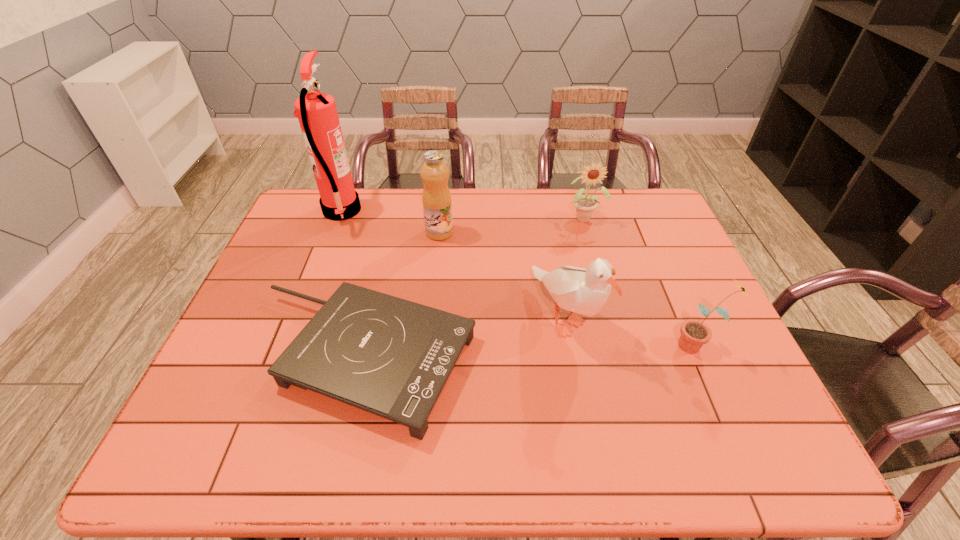
At what (x,y) coordinates should I click in order to perform the action: click on hotplate at the left edge. Please return your answer as a coordinate pair (x, y). The image size is (960, 540). Looking at the image, I should click on (391, 357).

The height and width of the screenshot is (540, 960). I want to click on object present at the right edge, so click(x=694, y=334).

I want to click on object located in the far left corner section of the desktop, so click(317, 113).

At what (x,y) coordinates should I click in order to perform the action: click on object located in the near left corner section of the desktop. Please return your answer as a coordinate pair (x, y). Image resolution: width=960 pixels, height=540 pixels. Looking at the image, I should click on (391, 357).

The image size is (960, 540). In order to click on vacant area at the far edge in this screenshot , I will do click(x=548, y=213).

I want to click on vacant region at the near edge of the desktop, so click(x=330, y=462).

Locate an element on the screen. The image size is (960, 540). free spot at the left edge of the desktop is located at coordinates (332, 231).

The image size is (960, 540). I want to click on vacant space at the right edge of the desktop, so click(673, 241).

The height and width of the screenshot is (540, 960). What are the coordinates of `free region at the far left corner` in the screenshot? It's located at (297, 226).

You are a GUI agent. You are given a task and a screenshot of the screen. Output one action in this format:
    pyautogui.click(x=<x>, y=<y>)
    Task: Click on the free region at the near left corner of the desktop
    Image resolution: width=960 pixels, height=540 pixels.
    Given the screenshot: What is the action you would take?
    pyautogui.click(x=200, y=450)